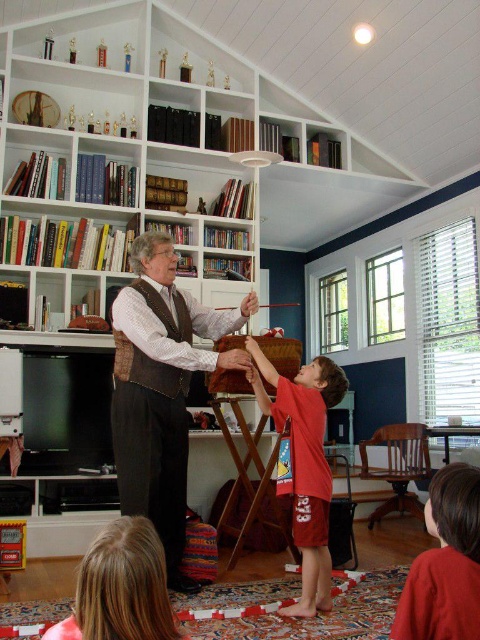
Question: Considering the real-world distances, which object is farthest from the red cotton shirt at lower right?

Choices:
 (A) red cotton shorts at lower center
 (B) brown leather vest at center

Answer: (B)

Question: Based on their relative distances, which object is nearer to the brown leather vest at center?

Choices:
 (A) red cotton shirt at lower right
 (B) white wood bookcase at upper center
 (C) red cotton shorts at lower center

Answer: (C)

Question: Is white wood bookcase at upper center above red cotton shirt at lower right?

Choices:
 (A) yes
 (B) no

Answer: (A)

Question: Can you confirm if white wood bookcase at upper center is positioned to the right of brown leather vest at center?

Choices:
 (A) no
 (B) yes

Answer: (A)

Question: Where is red cotton shorts at lower center located in relation to red cotton shirt at lower right in the image?

Choices:
 (A) right
 (B) left

Answer: (B)

Question: Which object is closer to the camera taking this photo?

Choices:
 (A) brown leather vest at center
 (B) red cotton shorts at lower center
 (C) white wood bookcase at upper center
 (D) red cotton shirt at lower right

Answer: (D)